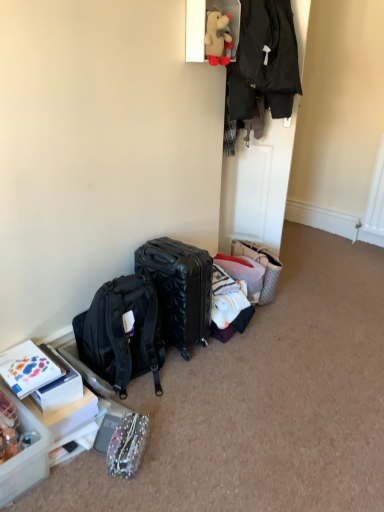
In order to face white plush teddy bear at upper center, should I rotate leftwards or rightwards?

Rotate your view right by about 4.253°.

The height and width of the screenshot is (512, 384). Describe the element at coordinates (217, 37) in the screenshot. I see `white plush teddy bear at upper center` at that location.

I want to click on matte black backpack at center, so click(x=122, y=333).

This screenshot has height=512, width=384. What do you see at coordinates (261, 264) in the screenshot?
I see `quilted beige handbag at lower right` at bounding box center [261, 264].

What do you see at coordinates (24, 456) in the screenshot?
I see `translucent plastic container at lower left` at bounding box center [24, 456].

In order to face black matte jacket at upper right, the 1th clothing viewed from the top, should I rotate leftwards or rightwards?

You should rotate right by 9.279 degrees.

This screenshot has height=512, width=384. Identify the location of white cotton shirt at center, placed as the 1th clothing when sorted from bottom to top. (228, 305).

The height and width of the screenshot is (512, 384). Describe the element at coordinates (179, 289) in the screenshot. I see `black hardshell suitcase at center` at that location.

I want to click on white plush teddy bear at upper center, so (217, 37).

Which of these two, black matte jacket at upper right, the second clothing from the bottom, or quilted beige handbag at lower right, stands shorter?

With less height is quilted beige handbag at lower right.

Considering the relative positions of black matte jacket at upper right, the second clothing from the bottom, and quilted beige handbag at lower right in the image provided, is black matte jacket at upper right, the second clothing from the bottom, to the right of quilted beige handbag at lower right from the viewer's perspective?

No, black matte jacket at upper right, the second clothing from the bottom, is not to the right of quilted beige handbag at lower right.

From a real-world perspective, count 2nd clothings upward from the quilted beige handbag at lower right and point to it. Please provide its 2D coordinates.

[(262, 65)]

Is black matte jacket at upper right, the second clothing from the bottom, not close to quilted beige handbag at lower right?

No, black matte jacket at upper right, the second clothing from the bottom, is not far away from quilted beige handbag at lower right.

From the image's perspective, relative to white plush teddy bear at upper center, is black textured suitcase at center above or below?

From the image's perspective, black textured suitcase at center appears below white plush teddy bear at upper center.

Which of these two, black textured suitcase at center or white plush teddy bear at upper center, is wider?

Wider between the two is black textured suitcase at center.

The width and height of the screenshot is (384, 512). I want to click on teddy bear on the left of black textured suitcase at center, so click(x=217, y=37).

Is the position of black textured suitcase at center more distant than that of white plush teddy bear at upper center?

That is True.

Can you see sparkly fabric pouch at lower left touching quilted beige handbag at lower right?

No, sparkly fabric pouch at lower left is not with quilted beige handbag at lower right.

Is sparkly fabric pouch at lower left not inside quilted beige handbag at lower right?

sparkly fabric pouch at lower left lies outside quilted beige handbag at lower right's area.

Is sparkly fabric pouch at lower left facing away from quilted beige handbag at lower right?

sparkly fabric pouch at lower left does not have its back to quilted beige handbag at lower right.

From the image's perspective, which one is positioned lower, sparkly fabric pouch at lower left or quilted beige handbag at lower right?

sparkly fabric pouch at lower left, from the image's perspective.

Can you confirm if black hardshell suitcase at center is thinner than white cotton shirt at center, placed as the 1th clothing when sorted from bottom to top?

Indeed, black hardshell suitcase at center has a lesser width compared to white cotton shirt at center, placed as the 1th clothing when sorted from bottom to top.

Does point (186, 286) lie behind point (230, 279)?

No, (186, 286) is in front of (230, 279).

Does black hardshell suitcase at center lie in front of white cotton shirt at center, arranged as the 2th clothing when viewed from the top?

Yes, black hardshell suitcase at center is in front of white cotton shirt at center, arranged as the 2th clothing when viewed from the top.

From a real-world perspective, is black hardshell suitcase at center on white cotton shirt at center, placed as the 1th clothing when sorted from bottom to top?

Yes, from a real-world perspective, black hardshell suitcase at center is on top of white cotton shirt at center, placed as the 1th clothing when sorted from bottom to top.

Where is `clothing that is the 1st one above the sparkly fabric pouch at lower left (from a real-world perspective)`? clothing that is the 1st one above the sparkly fabric pouch at lower left (from a real-world perspective) is located at coordinates (228, 305).

Is white cotton shirt at center, arranged as the 2th clothing when viewed from the top, directly adjacent to sparkly fabric pouch at lower left?

No, white cotton shirt at center, arranged as the 2th clothing when viewed from the top, is not next to sparkly fabric pouch at lower left.

From a real-world perspective, is white cotton shirt at center, arranged as the 2th clothing when viewed from the top, above or below sparkly fabric pouch at lower left?

From a real-world perspective, white cotton shirt at center, arranged as the 2th clothing when viewed from the top, is physically above sparkly fabric pouch at lower left.

How distant is white cotton shirt at center, arranged as the 2th clothing when viewed from the top, from sparkly fabric pouch at lower left?

The distance of white cotton shirt at center, arranged as the 2th clothing when viewed from the top, from sparkly fabric pouch at lower left is 73.03 centimeters.

Does point (276, 40) lie behind point (157, 290)?

Yes, it is.

Would you say black hardshell suitcase at center is part of black matte jacket at upper right, the 1th clothing viewed from the top,'s contents?

No, black hardshell suitcase at center is not a part of black matte jacket at upper right, the 1th clothing viewed from the top.

Based on the photo, is black matte jacket at upper right, the 1th clothing viewed from the top, looking in the opposite direction of black hardshell suitcase at center?

black matte jacket at upper right, the 1th clothing viewed from the top, does not have its back to black hardshell suitcase at center.

Locate an element on the screen. The width and height of the screenshot is (384, 512). clothing that appears above the black hardshell suitcase at center (from the image's perspective) is located at coordinates (262, 65).

Is point (19, 483) positioned before point (240, 264)?

Yes, it is in front of point (240, 264).

From the image's perspective, is translucent plastic container at lower left located above or below black textured suitcase at center?

From the image's perspective, translucent plastic container at lower left appears below black textured suitcase at center.

Does translucent plastic container at lower left have a greater width compared to black textured suitcase at center?

Correct, the width of translucent plastic container at lower left exceeds that of black textured suitcase at center.

At what (x,y) coordinates should I click in order to perform the action: click on handbag on the right of the black matte jacket at upper right, the second clothing from the bottom. Please return your answer as a coordinate pair (x, y). This screenshot has height=512, width=384. Looking at the image, I should click on point(261,264).

This screenshot has width=384, height=512. Find the location of `teddy bear in front of the black textured suitcase at center`. teddy bear in front of the black textured suitcase at center is located at coordinates (217, 37).

Considering their positions, is quilted beige handbag at lower right positioned closer to translucent plastic container at lower left than sparkly fabric pouch at lower left?

sparkly fabric pouch at lower left is closer to translucent plastic container at lower left.

When comparing their distances from sparkly fabric pouch at lower left, does black hardshell suitcase at center or black textured suitcase at center seem further?

black textured suitcase at center.

Estimate the real-world distances between objects in this image. Which object is further from black textured suitcase at center, quilted beige handbag at lower right or white cotton shirt at center, placed as the 1th clothing when sorted from bottom to top?

white cotton shirt at center, placed as the 1th clothing when sorted from bottom to top, lies further to black textured suitcase at center than the other object.

Considering their positions, is black textured suitcase at center positioned further to quilted beige handbag at lower right than black hardshell suitcase at center?

black hardshell suitcase at center.

Looking at the image, which one is located closer to sparkly fabric pouch at lower left, translucent plastic container at lower left or black matte jacket at upper right, the 1th clothing viewed from the top?

translucent plastic container at lower left is positioned closer to the anchor sparkly fabric pouch at lower left.

From the image, which object appears to be nearer to matte black backpack at center, sparkly fabric pouch at lower left or white cotton shirt at center, placed as the 1th clothing when sorted from bottom to top?

sparkly fabric pouch at lower left.

Based on their spatial positions, is white cotton shirt at center, arranged as the 2th clothing when viewed from the top, or translucent plastic container at lower left closer to black hardshell suitcase at center?

white cotton shirt at center, arranged as the 2th clothing when viewed from the top, is positioned closer to the anchor black hardshell suitcase at center.

When comparing their distances from quilted beige handbag at lower right, does sparkly fabric pouch at lower left or black textured suitcase at center seem closer?

black textured suitcase at center is closer to quilted beige handbag at lower right.

The height and width of the screenshot is (512, 384). What are the coordinates of `bag located between translucent plastic container at lower left and black textured suitcase at center in the depth direction` in the screenshot? It's located at (127, 445).

You are a GUI agent. You are given a task and a screenshot of the screen. Output one action in this format:
    pyautogui.click(x=<x>, y=<y>)
    Task: Click on the bag located between translucent plastic container at lower left and white cotton shirt at center, placed as the 1th clothing when sorted from bottom to top, in the left-right direction
    
    Given the screenshot: What is the action you would take?
    pyautogui.click(x=127, y=445)

Identify the location of backpack between sparkly fabric pouch at lower left and white cotton shirt at center, arranged as the 2th clothing when viewed from the top, from front to back. The image size is (384, 512). (122, 333).

Identify the location of luggage and bags between matte black backpack at center and white cotton shirt at center, arranged as the 2th clothing when viewed from the top, in the front-back direction. This screenshot has width=384, height=512. (179, 289).